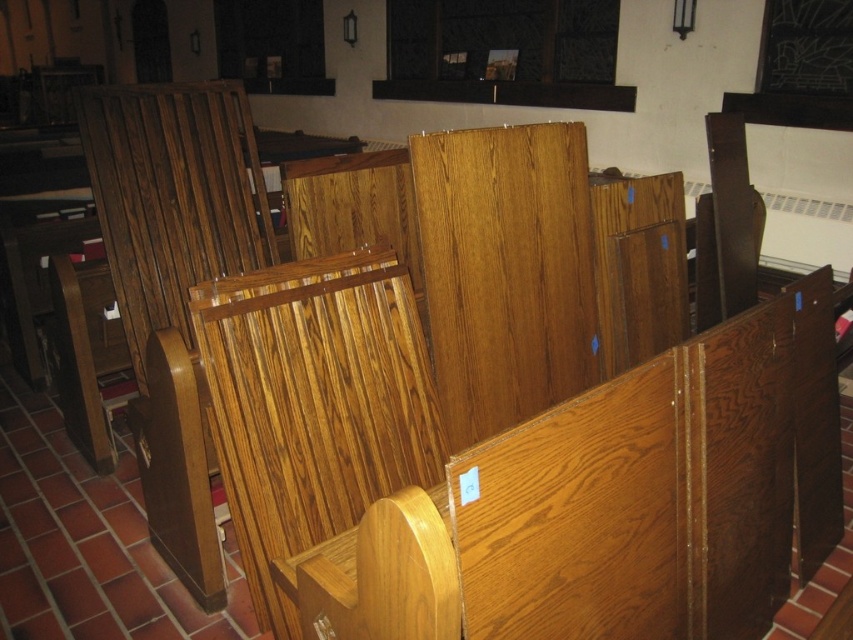
Between wooden church bench at center and wooden panel at center, which one appears on the left side from the viewer's perspective?

wooden panel at center is more to the left.

Which is in front, point (741, 506) or point (575, 237)?

Positioned in front is point (741, 506).

The height and width of the screenshot is (640, 853). What do you see at coordinates (740, 461) in the screenshot? I see `wooden church bench at center` at bounding box center [740, 461].

Image resolution: width=853 pixels, height=640 pixels. Find the location of `wooden church bench at center`. wooden church bench at center is located at coordinates (740, 461).